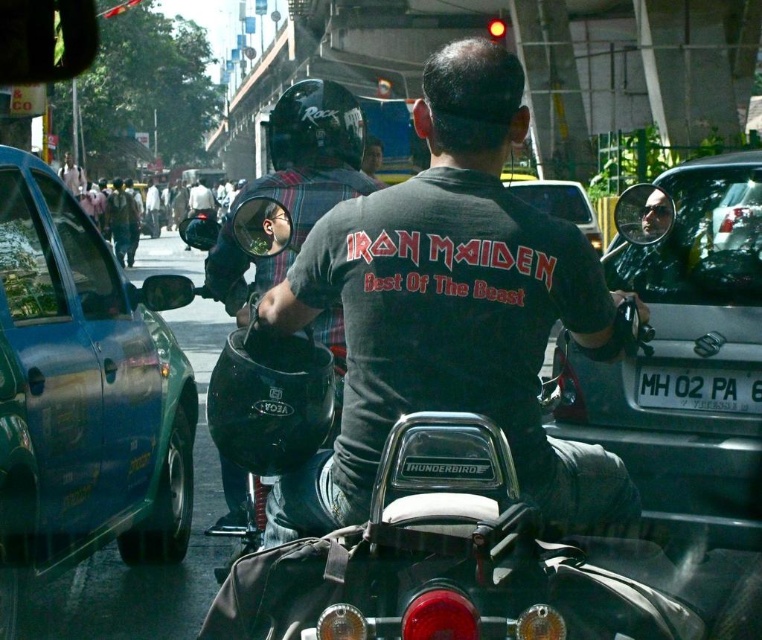
Question: Is green matte car at left smaller than silver metallic sedan at right?

Choices:
 (A) no
 (B) yes

Answer: (A)

Question: Which object appears closest to the camera in this image?

Choices:
 (A) green matte car at left
 (B) white plastic license plate at center
 (C) dark gray helmet at center
 (D) metallic silver car at center

Answer: (A)

Question: Considering the real-world distances, which object is closest to the matte black helmet at center?

Choices:
 (A) dark gray helmet at center
 (B) green matte car at left
 (C) matte black helmet at upper center

Answer: (B)

Question: Considering the real-world distances, which object is closest to the matte black helmet at upper center?

Choices:
 (A) metallic silver motorcycle at center
 (B) metallic silver car at center

Answer: (A)

Question: Considering the relative positions of matte black helmet at upper center and metallic silver car at center in the image provided, where is matte black helmet at upper center located with respect to metallic silver car at center?

Choices:
 (A) below
 (B) above

Answer: (A)

Question: Is metallic silver motorcycle at center wider than dark gray helmet at center?

Choices:
 (A) no
 (B) yes

Answer: (A)